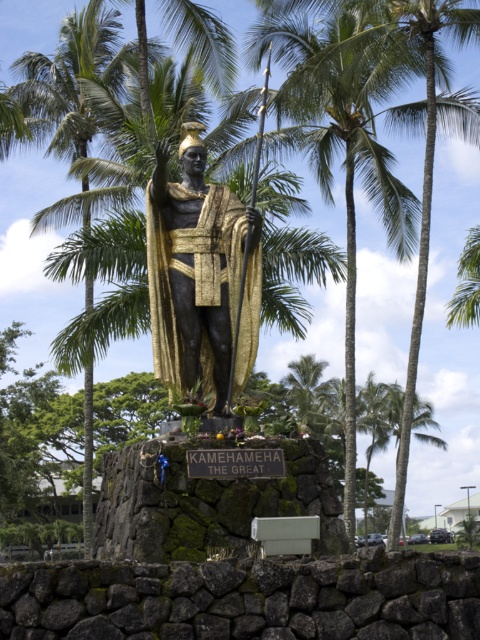
Question: Which point is closer to the camera?

Choices:
 (A) green leafy palm tree at left
 (B) bronze statue at center
 (C) green leafy palm tree at center

Answer: (B)

Question: Does green leafy palm tree at center appear on the right side of green leafy palm tree at left?

Choices:
 (A) no
 (B) yes

Answer: (B)

Question: Does green leafy palm tree at center appear on the left side of green leafy palm tree at left?

Choices:
 (A) no
 (B) yes

Answer: (A)

Question: Is green leafy palm tree at center to the left of green leafy palm tree at left from the viewer's perspective?

Choices:
 (A) no
 (B) yes

Answer: (A)

Question: Estimate the real-world distances between objects in this image. Which object is farther from the green leafy palm tree at left?

Choices:
 (A) bronze statue at center
 (B) green leafy palm tree at center

Answer: (A)

Question: Estimate the real-world distances between objects in this image. Which object is farther from the green leafy palm tree at center?

Choices:
 (A) bronze statue at center
 (B) green leafy palm tree at left

Answer: (A)